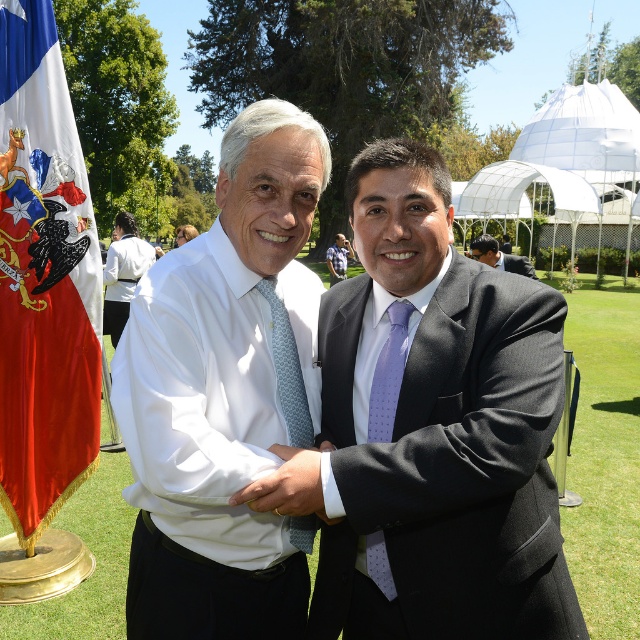
You are standing at the flagpole and want to walk to the man on the right. Which point, point (381, 408) or point (131, 224), is closer to your path?

Point (381, 408) is closer to your path because it is in front of point (131, 224).

You are a photographer at a formal event. You want to capture a closeup shot of both the lavender dotted silk tie at center and the light blue textured tie at center in the same frame. Given that your camera has a maximum focus range of 10 inches, will you be able to photograph both ties clearly in one shot?

The lavender dotted silk tie at center and light blue textured tie at center are 11.11 inches apart. Since the distance between them exceeds the camera maximum focus range of 10 inches, you will not be able to photograph both ties clearly in one shot.

You are a photographer trying to capture a closeup of the white matte shirt at center. You are currently positioned at the point marked as point (225, 394). Is the white matte shirt at center within your camera frame at this position?

Yes, the white matte shirt at center is located exactly at point (225, 394), so the photographer can capture it within the camera frame from this position.